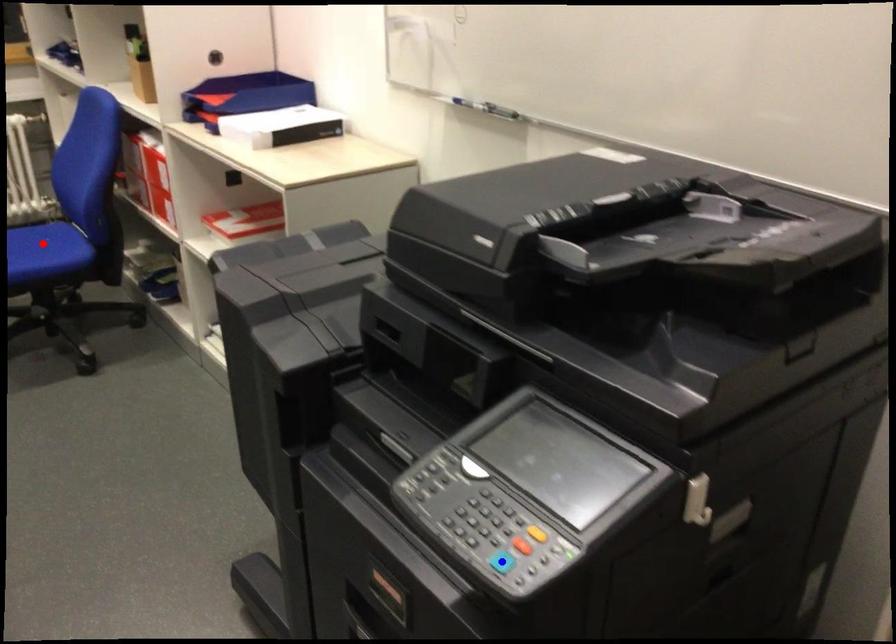
Question: In the image, two points are highlighted. Which point is nearer to the camera? Reply with the corresponding letter.

Choices:
 (A) blue point
 (B) red point

Answer: (A)